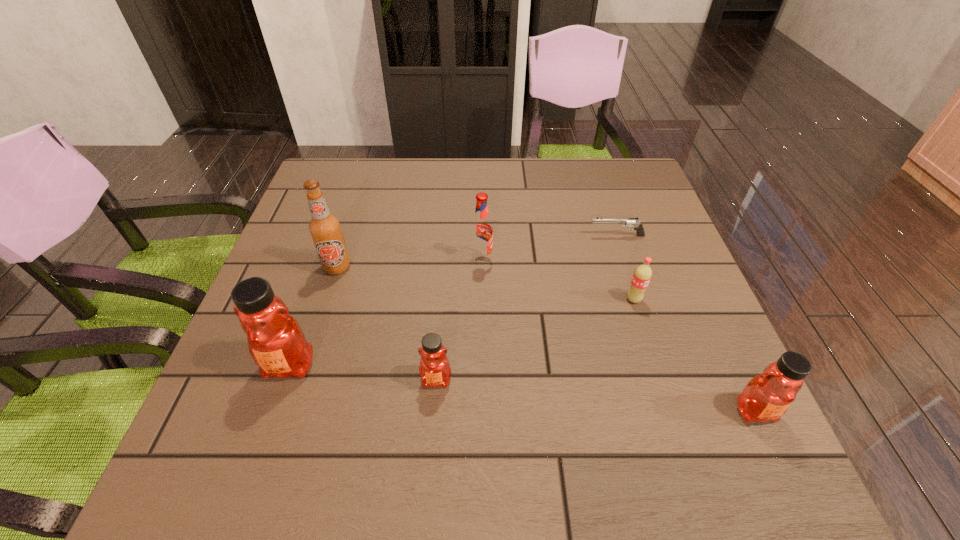
Identify the location of vacant region between the shortest object and the nearest object. The height and width of the screenshot is (540, 960). (685, 323).

Locate an element on the screen. empty space between the shortest honey and the soda is located at coordinates (535, 340).

Where is `empty space between the rightmost honey and the fourth farthest object`? empty space between the rightmost honey and the fourth farthest object is located at coordinates (694, 355).

Where is `free space between the second honey from right to left and the soda`? This screenshot has width=960, height=540. free space between the second honey from right to left and the soda is located at coordinates (535, 340).

The image size is (960, 540). Identify the location of unoccupied position between the root beer and the beer bottle. 409,264.

The width and height of the screenshot is (960, 540). What are the coordinates of `blank region between the fourth farthest object and the leftmost honey` in the screenshot? It's located at (462, 332).

Locate an element on the screen. The height and width of the screenshot is (540, 960). unoccupied area between the nearest honey and the farthest object is located at coordinates (685, 323).

What are the coordinates of `vacant region between the farthest object and the fifth object from right to left` in the screenshot? It's located at (526, 308).

At what (x,y) coordinates should I click in order to perform the action: click on object that is the nearest to the rightmost honey. Please return your answer as a coordinate pair (x, y). The width and height of the screenshot is (960, 540). Looking at the image, I should click on (642, 275).

Identify which object is the second nearest to the rightmost honey. Please provide its 2D coordinates. Your answer should be formatted as a tuple, i.e. [(x, y)], where the tuple contains the x and y coordinates of a point satisfying the conditions above.

[(626, 222)]